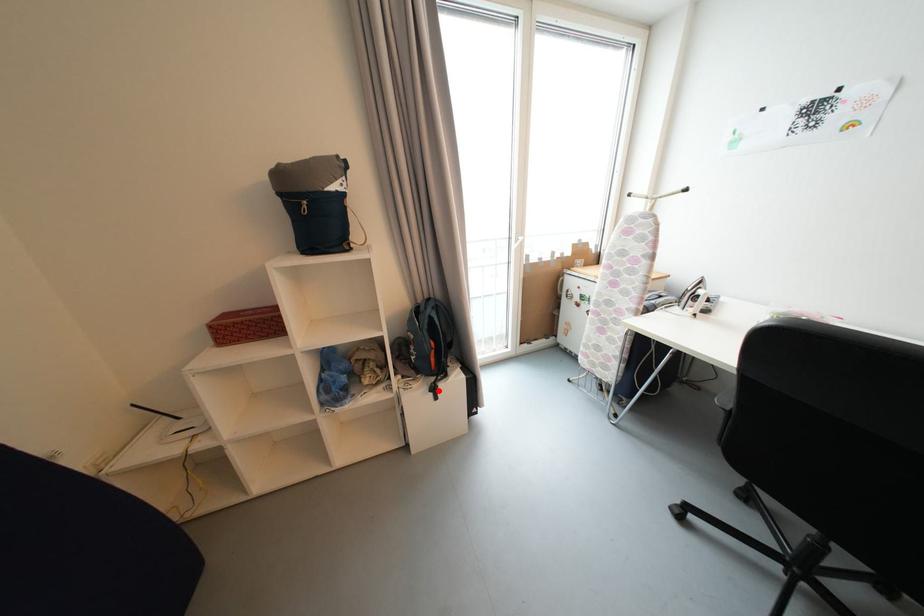
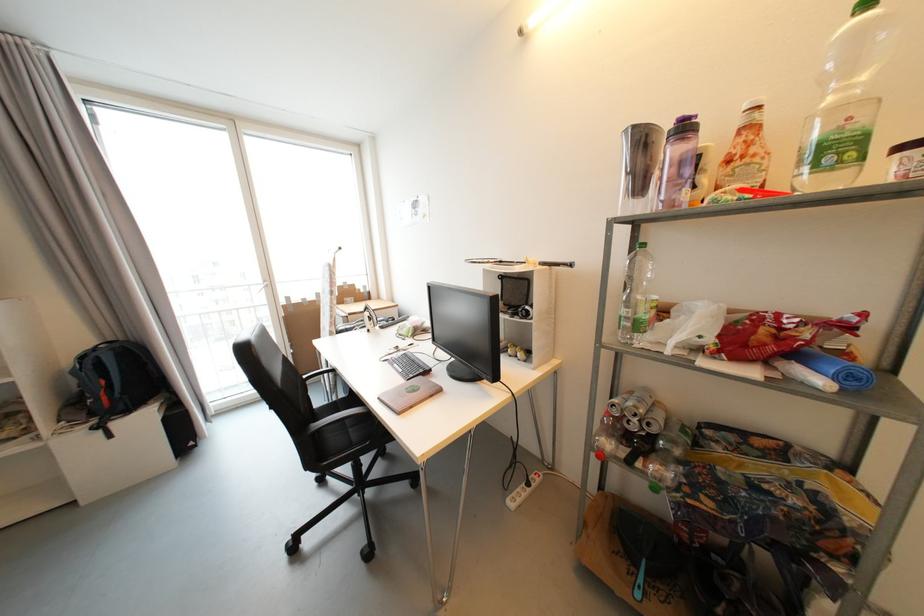
Find the pixel in the second image that matches the highlighted location in the first image.

(104, 429)